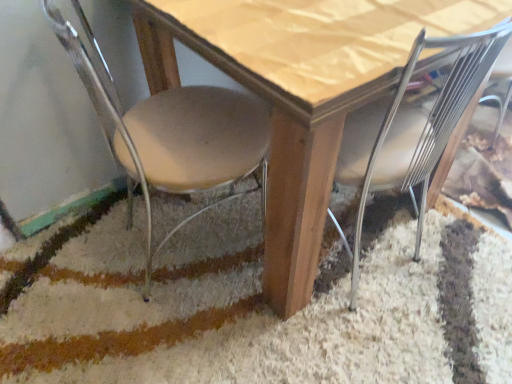
Question: Based on their sizes in the image, would you say beige fabric chair at lower left, acting as the second chair starting from the right, is bigger or smaller than metallic silver chair at lower right, the second chair when ordered from left to right?

Choices:
 (A) small
 (B) big

Answer: (B)

Question: From the image's perspective, is beige fabric chair at lower left, the 1th chair in the left-to-right sequence, positioned above or below metallic silver chair at lower right, positioned as the first chair in right-to-left order?

Choices:
 (A) below
 (B) above

Answer: (B)

Question: Estimate the real-world distances between objects in this image. Which object is farther from the beige fabric chair at lower left, the 1th chair in the left-to-right sequence?

Choices:
 (A) wooden table at center
 (B) metallic silver chair at lower right, the second chair when ordered from left to right

Answer: (B)

Question: Based on their relative distances, which object is farther from the metallic silver chair at lower right, positioned as the first chair in right-to-left order?

Choices:
 (A) wooden table at center
 (B) beige fabric chair at lower left, the 1th chair in the left-to-right sequence

Answer: (B)